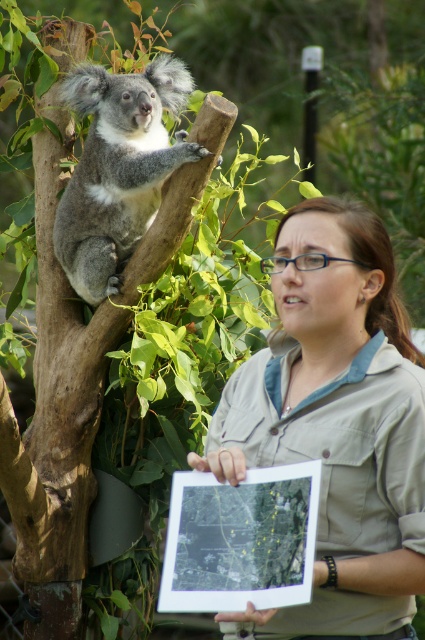
Can you confirm if gray furry koala at upper left is positioned above black paper map at upper center?

Yes, gray furry koala at upper left is above black paper map at upper center.

Is gray furry koala at upper left further to the viewer compared to black paper map at upper center?

Yes, gray furry koala at upper left is behind black paper map at upper center.

The image size is (425, 640). Identify the location of gray furry koala at upper left. (118, 168).

The height and width of the screenshot is (640, 425). What do you see at coordinates (337, 420) in the screenshot?
I see `matte khaki shirt at center` at bounding box center [337, 420].

Measure the distance between matte khaki shirt at center and camera.

matte khaki shirt at center is 20.04 feet from camera.

Who is more forward, [291,419] or [110,230]?

Point [291,419]

Locate an element on the screen. The height and width of the screenshot is (640, 425). matte khaki shirt at center is located at coordinates (337, 420).

Is point (376, 522) positioned behind point (180, 484)?

No, (376, 522) is in front of (180, 484).

Where is `matte khaki shirt at center`? matte khaki shirt at center is located at coordinates (337, 420).

What do you see at coordinates (337, 420) in the screenshot? The height and width of the screenshot is (640, 425). I see `matte khaki shirt at center` at bounding box center [337, 420].

This screenshot has height=640, width=425. What are the coordinates of `matte khaki shirt at center` in the screenshot? It's located at (337, 420).